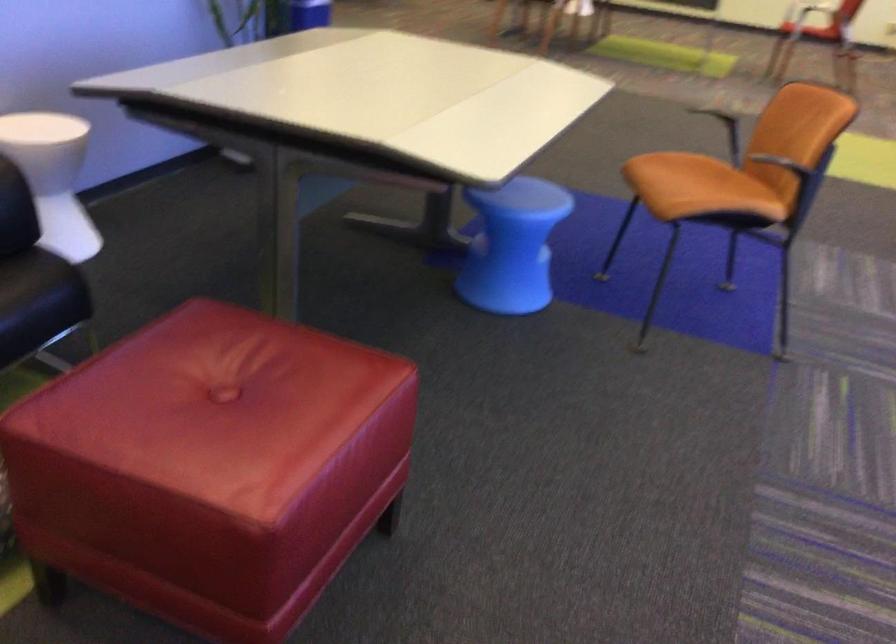
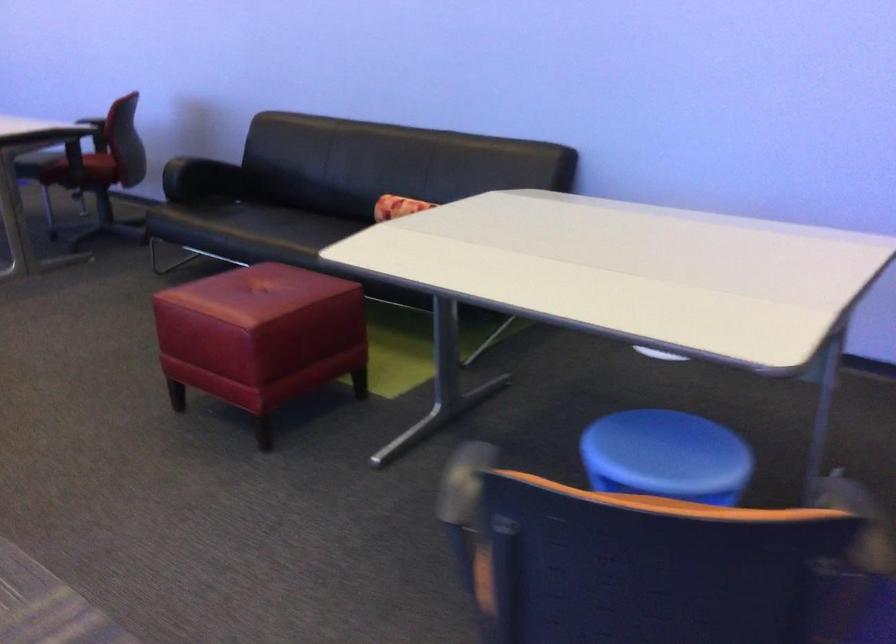
Question: I am providing you with two images of the same scene from different viewpoints. After the viewpoint changes to image2, which objects are now occluded?

Choices:
 (A) sofa armrest
 (B) red chair sitting surface
 (C) patterned pillow
 (D) none of these

Answer: (D)